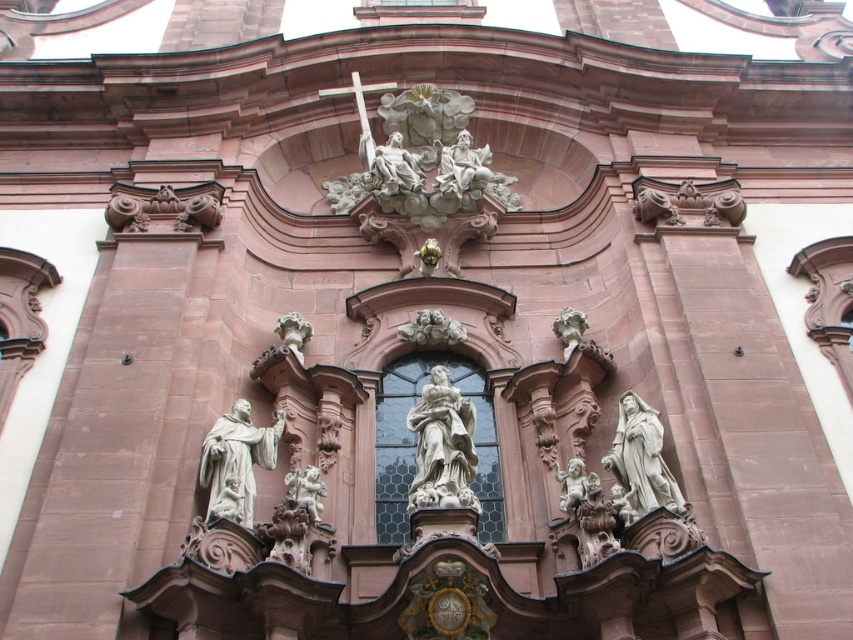
You are an art restorer assessing the church facade. You need to determine if the white stone sculpture at upper center can be safely moved to the position currently occupied by the white stone statue at center without compromising the structural integrity. Based on their widths, is this feasible?

The white stone sculpture at upper center might be wider than the white stone statue at center, so moving it could potentially compromise the structural integrity due to the possible width difference.

You are an art student analyzing the church facade. You notice the white stone sculpture at upper center and the white stone statue at center. Which one is positioned closer to the front of the facade?

The white stone statue at center is behind the white stone sculpture at upper center, so the white stone sculpture at upper center is closer to the front of the facade.